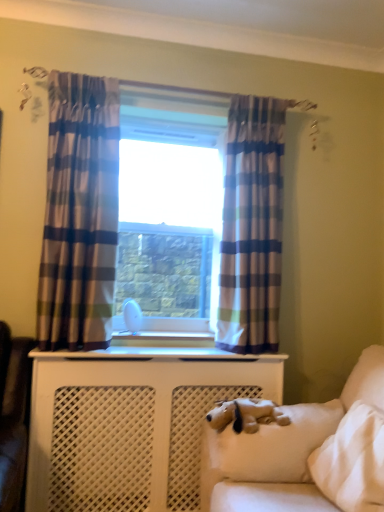
Question: Does blue plaid curtain at center, the 1th curtain in the right-to-left sequence, appear on the left side of white glossy radiator at center?

Choices:
 (A) yes
 (B) no

Answer: (B)

Question: From the image's perspective, does blue plaid curtain at center, which ranks as the 2th curtain in left-to-right order, appear higher than white glossy radiator at center?

Choices:
 (A) yes
 (B) no

Answer: (A)

Question: Can you confirm if blue plaid curtain at center, which ranks as the 2th curtain in left-to-right order, is bigger than white glossy radiator at center?

Choices:
 (A) yes
 (B) no

Answer: (A)

Question: From a real-world perspective, is blue plaid curtain at center, the 1th curtain in the right-to-left sequence, on white glossy radiator at center?

Choices:
 (A) no
 (B) yes

Answer: (B)

Question: Considering the relative positions of blue plaid curtain at center, the 1th curtain in the right-to-left sequence, and white glossy radiator at center in the image provided, is blue plaid curtain at center, the 1th curtain in the right-to-left sequence, in front of white glossy radiator at center?

Choices:
 (A) no
 (B) yes

Answer: (B)

Question: Is white glossy radiator at center spatially inside clear glass window at center, or outside of it?

Choices:
 (A) outside
 (B) inside

Answer: (A)

Question: Considering the positions of white glossy radiator at center and clear glass window at center in the image, is white glossy radiator at center wider or thinner than clear glass window at center?

Choices:
 (A) wide
 (B) thin

Answer: (A)

Question: Is white glossy radiator at center to the left or to the right of clear glass window at center in the image?

Choices:
 (A) right
 (B) left

Answer: (B)

Question: From the image's perspective, is white glossy radiator at center positioned above or below clear glass window at center?

Choices:
 (A) below
 (B) above

Answer: (A)

Question: In terms of height, does brown plush dog at lower right look taller or shorter compared to clear glass window at center?

Choices:
 (A) tall
 (B) short

Answer: (B)

Question: Choose the correct answer: Is brown plush dog at lower right inside clear glass window at center or outside it?

Choices:
 (A) inside
 (B) outside

Answer: (B)

Question: Is brown plush dog at lower right to the left or to the right of clear glass window at center in the image?

Choices:
 (A) left
 (B) right

Answer: (B)

Question: Based on their sizes in the image, would you say brown plush dog at lower right is bigger or smaller than clear glass window at center?

Choices:
 (A) small
 (B) big

Answer: (A)

Question: Does point (160, 271) appear closer or farther from the camera than point (139, 331)?

Choices:
 (A) farther
 (B) closer

Answer: (A)

Question: In terms of size, does clear glass window at center appear bigger or smaller than white glossy radiator at center?

Choices:
 (A) small
 (B) big

Answer: (B)